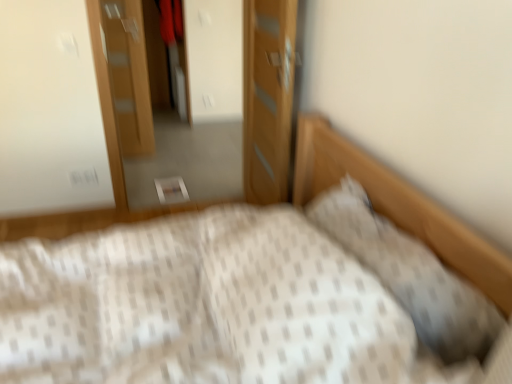
Question: From the image's perspective, is wooden dresser at center above or below white textured pillow at upper right?

Choices:
 (A) below
 (B) above

Answer: (B)

Question: Based on their positions, is wooden dresser at center located to the left or right of white textured pillow at upper right?

Choices:
 (A) right
 (B) left

Answer: (B)

Question: Which of these objects is positioned closest to the wooden dresser at center?

Choices:
 (A) wooden door at center, which is the 2th door in back-to-front order
 (B) white textured pillow at upper right
 (C) wooden door at upper left, arranged as the 2th door when viewed from the front
 (D) white textured bed at center

Answer: (A)

Question: Which object is positioned farthest from the wooden door at upper left, acting as the 1th door starting from the left?

Choices:
 (A) white textured pillow at upper right
 (B) white textured bed at center
 (C) wooden door at center, the 2th door from the left
 (D) wooden dresser at center

Answer: (A)